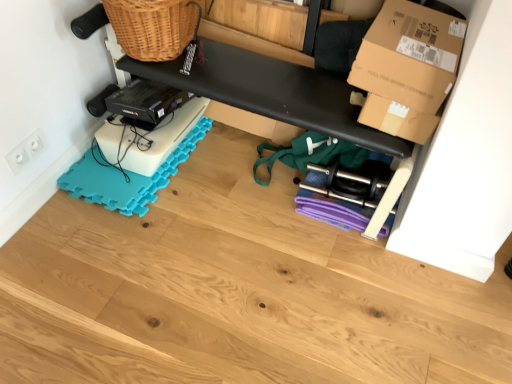
Question: Can you confirm if wooden floor at lower center is taller than black matte bench at upper center?

Choices:
 (A) no
 (B) yes

Answer: (A)

Question: Is wooden floor at lower center further to the viewer compared to black matte bench at upper center?

Choices:
 (A) no
 (B) yes

Answer: (A)

Question: From a real-world perspective, is wooden floor at lower center positioned under black matte bench at upper center based on gravity?

Choices:
 (A) yes
 (B) no

Answer: (A)

Question: Are wooden floor at lower center and black matte bench at upper center far apart?

Choices:
 (A) no
 (B) yes

Answer: (A)

Question: From the image's perspective, is wooden floor at lower center below black matte bench at upper center?

Choices:
 (A) yes
 (B) no

Answer: (A)

Question: From the image's perspective, relative to white plastic electrical outlet at lower left, is teal foam yoga mat at lower left above or below?

Choices:
 (A) below
 (B) above

Answer: (B)

Question: Considering their positions, is teal foam yoga mat at lower left located in front of or behind white plastic electrical outlet at lower left?

Choices:
 (A) front
 (B) behind

Answer: (B)

Question: Does point (183, 157) appear closer or farther from the camera than point (15, 163)?

Choices:
 (A) farther
 (B) closer

Answer: (A)

Question: Is teal foam yoga mat at lower left wider or thinner than white plastic electrical outlet at lower left?

Choices:
 (A) wide
 (B) thin

Answer: (A)

Question: From a real-world perspective, is white plastic electrical outlet at lower left above or below brown cardboard box at upper right?

Choices:
 (A) above
 (B) below

Answer: (B)

Question: Based on their sizes in the image, would you say white plastic electrical outlet at lower left is bigger or smaller than brown cardboard box at upper right?

Choices:
 (A) small
 (B) big

Answer: (A)

Question: Is white plastic electrical outlet at lower left in front of or behind brown cardboard box at upper right in the image?

Choices:
 (A) front
 (B) behind

Answer: (B)

Question: Would you say white plastic electrical outlet at lower left is to the left or to the right of brown cardboard box at upper right in the picture?

Choices:
 (A) left
 (B) right

Answer: (A)

Question: Is brown cardboard box at upper right spatially inside black matte bench at upper center, or outside of it?

Choices:
 (A) inside
 (B) outside

Answer: (B)

Question: Is brown cardboard box at upper right taller or shorter than black matte bench at upper center?

Choices:
 (A) tall
 (B) short

Answer: (B)